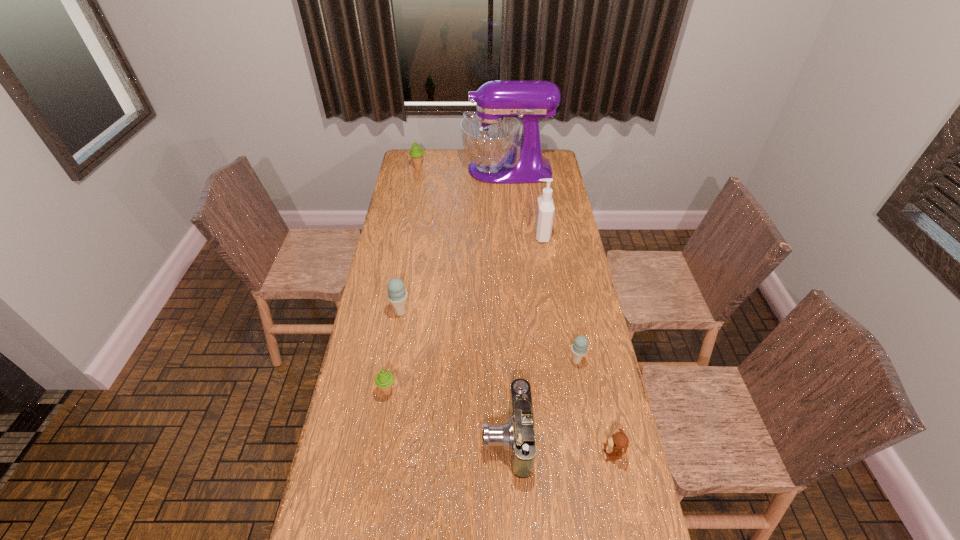
You are a GUI agent. You are given a task and a screenshot of the screen. Output one action in this format:
    pyautogui.click(x=<x>, y=<y>)
    Task: Click on the vacant space located on the front label of the seventh shortest object
    
    Given the screenshot: What is the action you would take?
    pyautogui.click(x=506, y=235)

I want to click on free space located 0.110m on the back of the farthest ice cream, so click(420, 154).

The width and height of the screenshot is (960, 540). I want to click on free spot located on the front of the bigger blue ice cream, so click(383, 415).

Locate an element on the screen. The width and height of the screenshot is (960, 540). free space located 0.130m on the front-facing side of the camcorder is located at coordinates (438, 437).

I want to click on vacant space located 0.160m on the front-facing side of the camcorder, so click(428, 437).

The image size is (960, 540). In order to click on free spot located 0.370m on the front-facing side of the camcorder in this screenshot , I will do `click(357, 437)`.

Find the location of a particular element. This screenshot has width=960, height=540. free region located on the left of the third nearest object is located at coordinates (360, 391).

Find the location of `free space located 0.210m on the left of the fourth nearest object`. free space located 0.210m on the left of the fourth nearest object is located at coordinates (507, 361).

Identify the location of free space located 0.230m on the face of the teddy bear. The width and height of the screenshot is (960, 540). (522, 453).

Identify the location of free space located 0.240m on the face of the teddy bear. Image resolution: width=960 pixels, height=540 pixels. (519, 453).